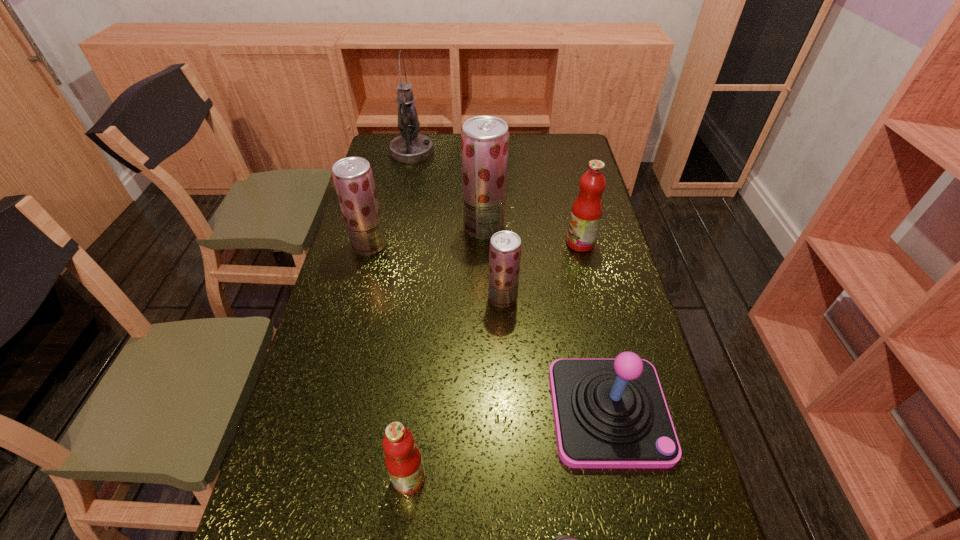
Identify the location of vacant area that lies between the right pink fruit juice and the pink joystick. (594, 327).

This screenshot has width=960, height=540. I want to click on free space between the joystick and the nearest fruit juice, so click(x=509, y=445).

This screenshot has width=960, height=540. I want to click on empty space between the smaller pink fruit juice and the second smallest strawberry fruit juice, so click(x=389, y=362).

Where is `free space between the second nearest fruit juice and the oil lamp`? Image resolution: width=960 pixels, height=540 pixels. free space between the second nearest fruit juice and the oil lamp is located at coordinates (457, 225).

Locate an element on the screen. The width and height of the screenshot is (960, 540). free spot between the tallest fruit juice and the farthest object is located at coordinates (448, 190).

The image size is (960, 540). Find the location of `vacant point located between the nearer pink fruit juice and the tallest fruit juice`. vacant point located between the nearer pink fruit juice and the tallest fruit juice is located at coordinates (446, 353).

Image resolution: width=960 pixels, height=540 pixels. What are the coordinates of `free spot between the right pink fruit juice and the leftmost fruit juice` in the screenshot? It's located at (474, 244).

The image size is (960, 540). I want to click on vacant area that lies between the right pink fruit juice and the biggest strawberry fruit juice, so click(532, 235).

Find the location of `vacant region between the pink joystick and the right pink fruit juice`. vacant region between the pink joystick and the right pink fruit juice is located at coordinates (594, 327).

Where is `object that stands as the third closest to the tallest fruit juice`? The height and width of the screenshot is (540, 960). object that stands as the third closest to the tallest fruit juice is located at coordinates (353, 178).